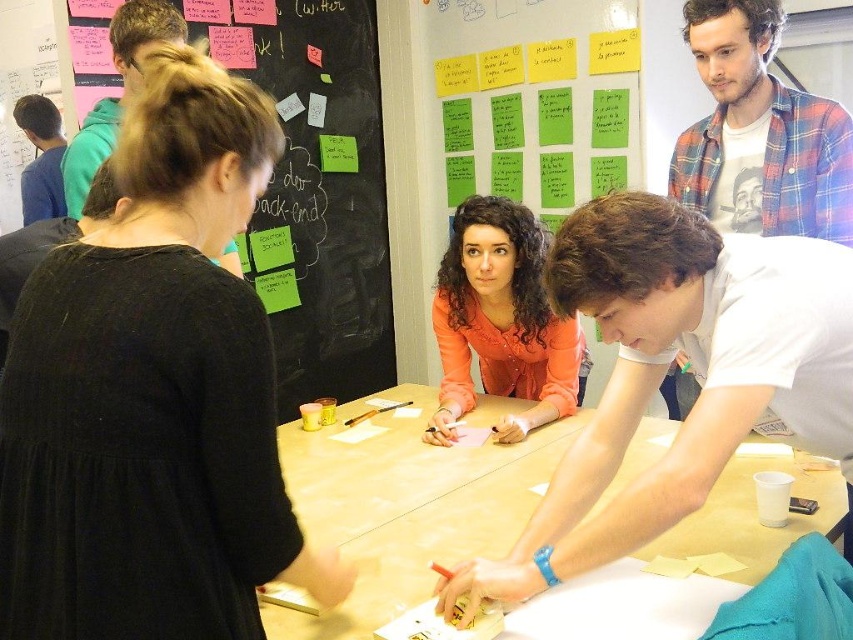
Is blackboard with sticky notes at upper left wider than plaid flannel shirt at upper right?

Yes.

Between blackboard with sticky notes at upper left and plaid flannel shirt at upper right, which one appears on the left side from the viewer's perspective?

Positioned to the left is blackboard with sticky notes at upper left.

What do you see at coordinates (320, 189) in the screenshot? I see `blackboard with sticky notes at upper left` at bounding box center [320, 189].

I want to click on blackboard with sticky notes at upper left, so click(320, 189).

Who is lower down, black matte shirt at upper left or light brown wood table at center?

light brown wood table at center

Locate an element on the screen. The image size is (853, 640). black matte shirt at upper left is located at coordinates (154, 394).

Where is `black matte shirt at upper left`? black matte shirt at upper left is located at coordinates point(154,394).

Does orange matte shirt at center have a smaller size compared to green matte paper at upper left?

Actually, orange matte shirt at center might be larger than green matte paper at upper left.

Where is `orange matte shirt at center`? This screenshot has height=640, width=853. orange matte shirt at center is located at coordinates (502, 321).

Is point (468, 401) positioned behind point (256, 250)?

No.

Identify the location of orange matte shirt at center. (502, 321).